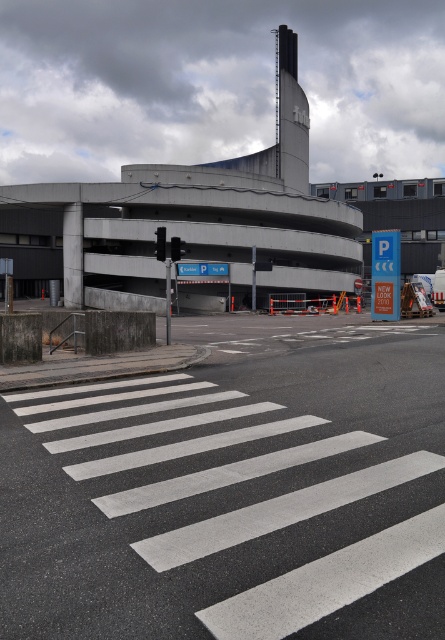
Question: Which object is closer to the camera taking this photo?

Choices:
 (A) white asphalt crosswalk at center
 (B) black glass traffic light at center

Answer: (A)

Question: Does white asphalt crosswalk at center appear on the left side of red glass traffic light at center?

Choices:
 (A) yes
 (B) no

Answer: (B)

Question: Among these objects, which one is nearest to the camera?

Choices:
 (A) red glass traffic light at center
 (B) white asphalt crosswalk at center
 (C) black glass traffic light at center

Answer: (B)

Question: Can you confirm if white asphalt crosswalk at center is positioned below black glass traffic light at center?

Choices:
 (A) yes
 (B) no

Answer: (A)

Question: Which is farther from the red glass traffic light at center?

Choices:
 (A) white asphalt crosswalk at center
 (B) black glass traffic light at center

Answer: (A)

Question: Does white asphalt crosswalk at center appear under red glass traffic light at center?

Choices:
 (A) no
 (B) yes

Answer: (B)